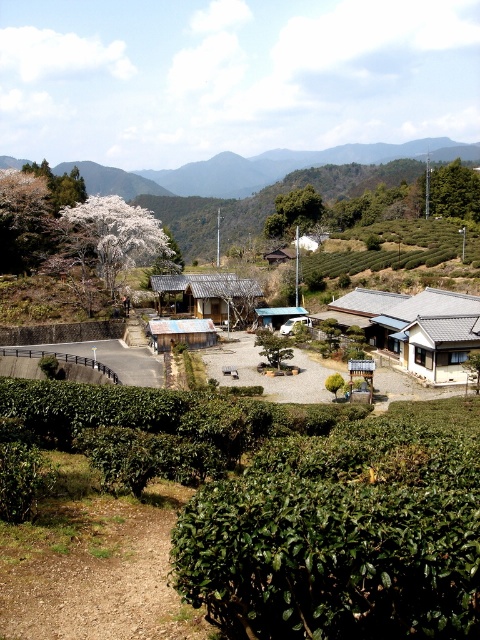
You are standing in the rural landscape and want to walk from the green grassy hillside at upper left to the green leafy tree at center. Which direction should you move to get closer to the tree?

You should move towards the center of the image because the green leafy tree at center is closer to you than the green grassy hillside at upper left.

You are a hiker planning to take a photo of the green leafy tree at center and the green grassy hillside at upper left. Which object should you focus on first if you want to capture both in a single frame without moving the camera?

You should focus on the green leafy tree at center first because the green grassy hillside at upper left is above it, so adjusting the camera to include the hillside above the tree will ensure both are in frame.